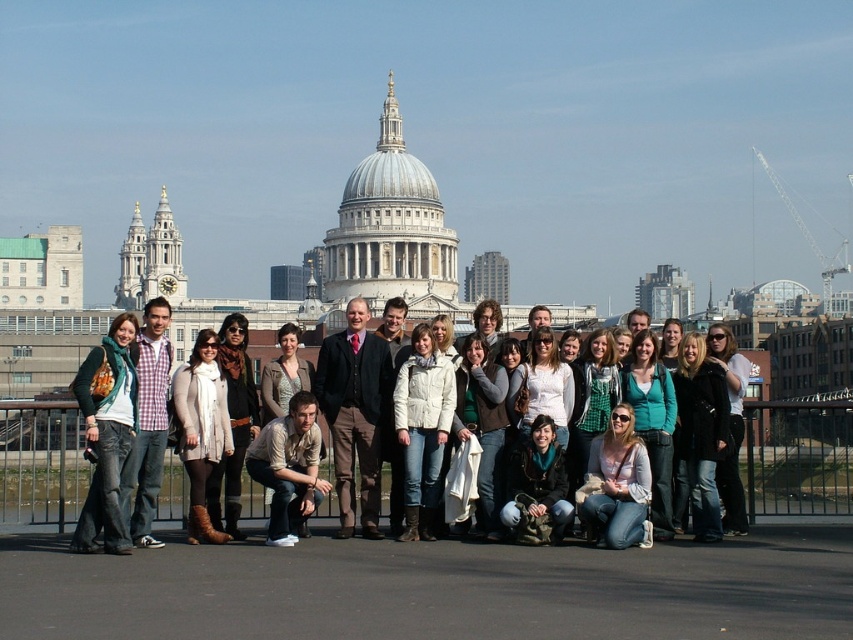
Question: Is checkered fabric shirt at left to the right of matte black jacket at center from the viewer's perspective?

Choices:
 (A) yes
 (B) no

Answer: (B)

Question: From the image, what is the correct spatial relationship of checkered fabric shirt at left in relation to matte black jacket at center?

Choices:
 (A) left
 (B) right

Answer: (A)

Question: Which of the following is the closest to the observer?

Choices:
 (A) matte black jacket at center
 (B) khaki cotton shirt at center
 (C) denim jacket at lower right

Answer: (C)

Question: Which point is farther to the camera?

Choices:
 (A) (534, 531)
 (B) (613, 492)
 (C) (84, 552)

Answer: (B)

Question: Is denim jacket at lower right thinner than matte black jacket at center?

Choices:
 (A) yes
 (B) no

Answer: (B)

Question: Which object is the closest to the matte black jacket at center?

Choices:
 (A) denim jacket at left
 (B) denim jacket at lower right
 (C) checkered fabric shirt at left
 (D) khaki cotton shirt at center

Answer: (B)